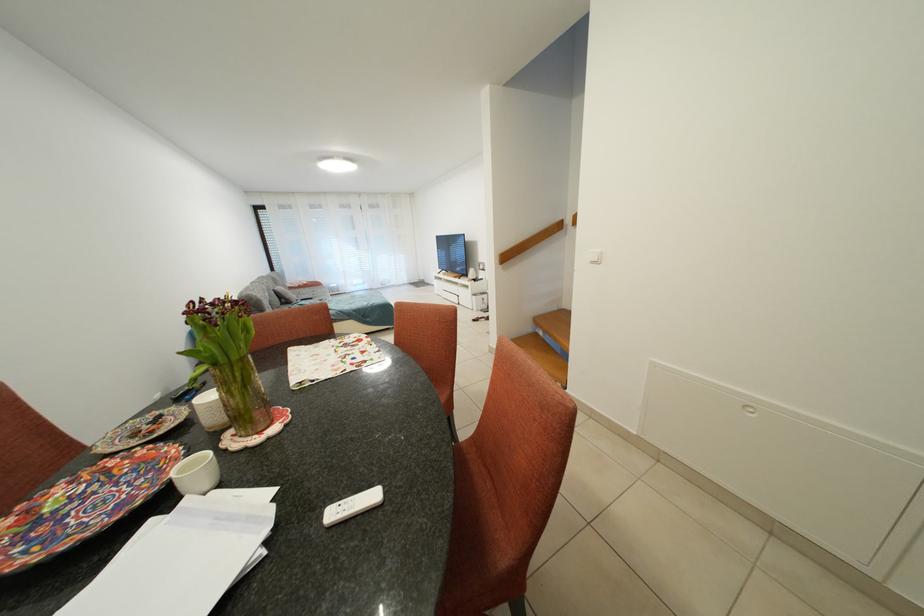
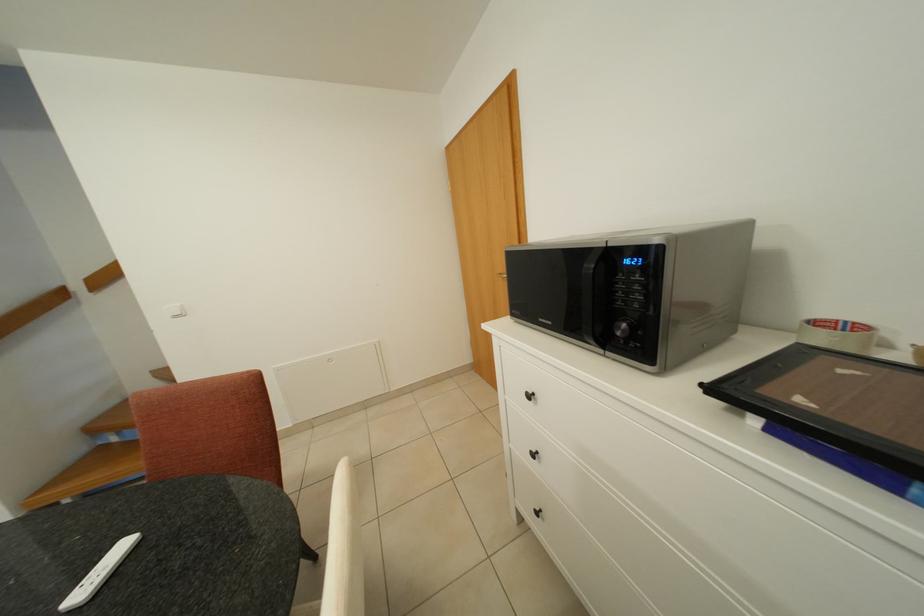
Question: Based on the continuous images, in which direction is the camera rotating? Reply with the corresponding letter.

Choices:
 (A) Left
 (B) Right
 (C) Up
 (D) Down

Answer: (B)